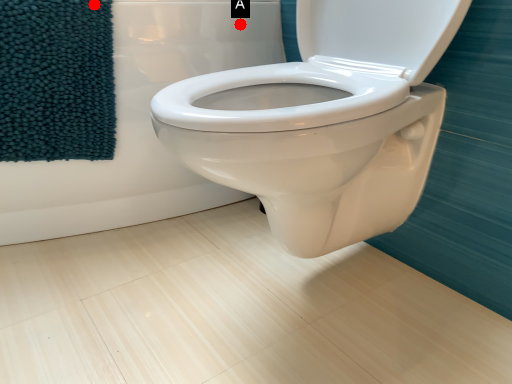
Question: Two points are circled on the image, labeled by A and B beside each circle. Which point is closer to the camera?

Choices:
 (A) A is closer
 (B) B is closer

Answer: (B)